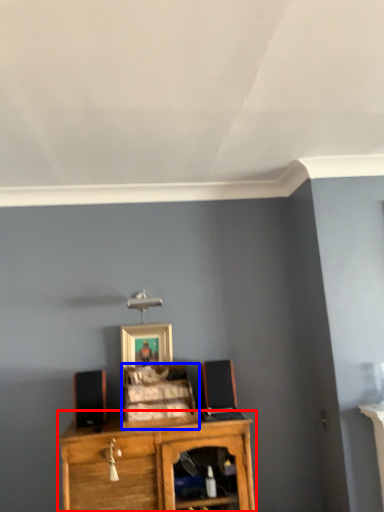
Question: Which of the following is the closest to the observer, shelf (highlighted by a red box) or cabinet (highlighted by a blue box)?

Choices:
 (A) shelf
 (B) cabinet

Answer: (A)